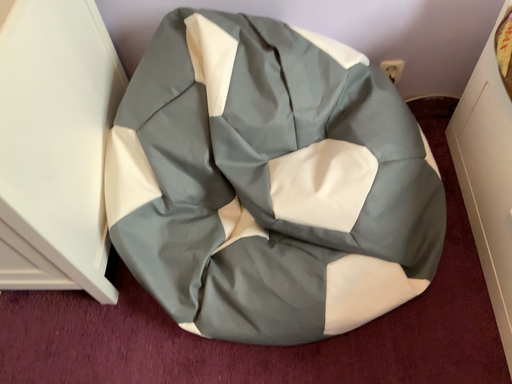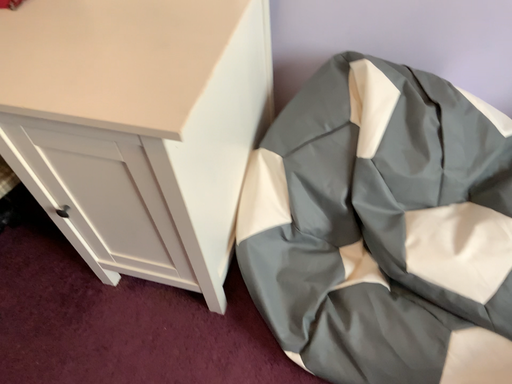
Question: How did the camera likely rotate when shooting the video?

Choices:
 (A) rotated left
 (B) rotated right

Answer: (A)